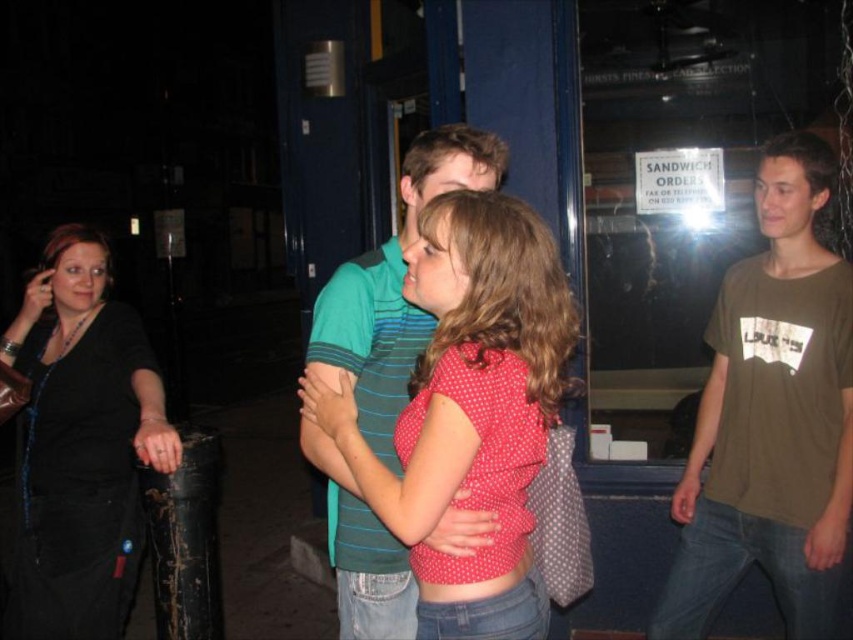
Between point (496, 250) and point (144, 456), which one is positioned behind?

Positioned behind is point (144, 456).

This screenshot has width=853, height=640. Find the location of `polka dot fabric shirt at center`. polka dot fabric shirt at center is located at coordinates (469, 410).

Does brown cotton t-shirt at right have a greater height compared to polka dot fabric shirt at center?

Yes.

Is point (827, 552) less distant than point (569, 353)?

Yes.

Identify the location of brown cotton t-shirt at right. The image size is (853, 640). (772, 417).

The width and height of the screenshot is (853, 640). What are the coordinates of `brown cotton t-shirt at right` in the screenshot? It's located at (772, 417).

Does point (790, 243) come in front of point (125, 605)?

That is True.

This screenshot has height=640, width=853. What are the coordinates of `brown cotton t-shirt at right` in the screenshot? It's located at (772, 417).